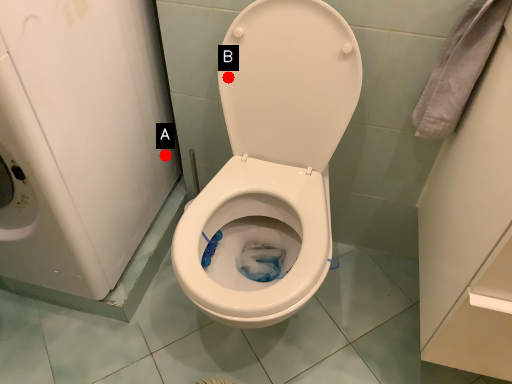
Question: Two points are circled on the image, labeled by A and B beside each circle. Which point is farther from the camera taking this photo?

Choices:
 (A) A is further
 (B) B is further

Answer: (A)